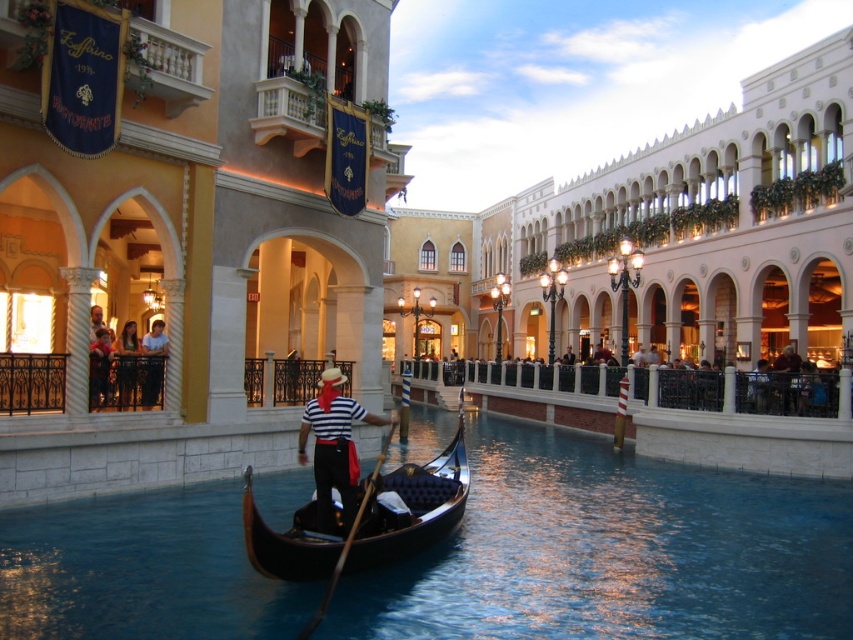
Is matte black striped shirt at center above white cotton shirt at center?

Incorrect, matte black striped shirt at center is not positioned above white cotton shirt at center.

Can you confirm if matte black striped shirt at center is positioned below white cotton shirt at center?

Yes.

You are a GUI agent. You are given a task and a screenshot of the screen. Output one action in this format:
    pyautogui.click(x=<x>, y=<y>)
    Task: Click on the matte black striped shirt at center
    This screenshot has width=853, height=640.
    Given the screenshot: What is the action you would take?
    pyautogui.click(x=334, y=448)

Is black glossy water at center further to the viewer compared to black polished gondola at center?

No, black glossy water at center is closer to the viewer.

Does point (155, 609) come farther from viewer compared to point (393, 552)?

No, (155, 609) is in front of (393, 552).

Where is `black glossy water at center`? black glossy water at center is located at coordinates (613, 550).

Which of these two, black polished gondola at center or matte black striped shirt at center, stands shorter?

Standing shorter between the two is black polished gondola at center.

Which is behind, point (457, 417) or point (335, 376)?

Point (457, 417)

Who is more forward, [335,557] or [320,440]?

Point [335,557] is more forward.

Where is `black polished gondola at center`? The width and height of the screenshot is (853, 640). black polished gondola at center is located at coordinates (366, 518).